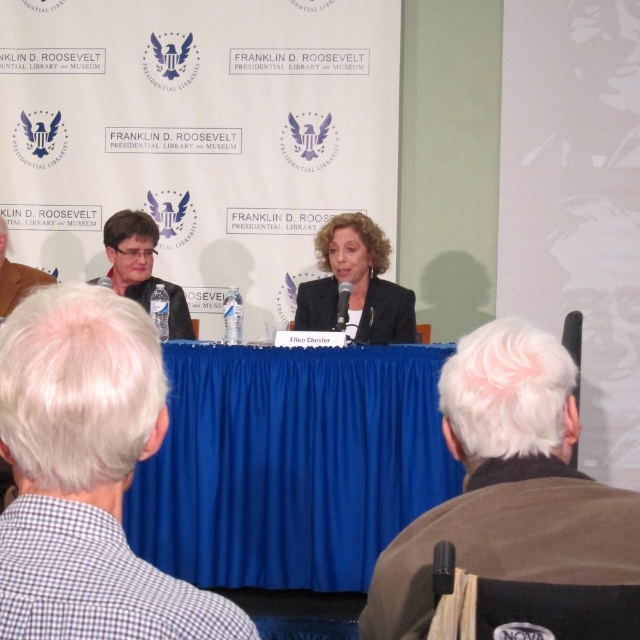
Looking at this image, you are attending the event and want to know the position of the two speakers. Which speaker is wearing the checkered fabric shirt at lower left relative to the brown wool jacket at lower right?

The checkered fabric shirt at lower left is to the left of the brown wool jacket at lower right.

You are attending the event at the Franklin D. Roosevelt Presidential Library and Museum and notice two people sitting at the table. One is wearing a matte black suit at center and the other a matte black jacket at left. Which one is sitting closer to the front of the table?

The matte black suit at center is closer to the viewer than the matte black jacket at left, so the person in the matte black suit at center is sitting closer to the front of the table.

You are attending the event at the Franklin D. Roosevelt Presidential Library and Museum and are standing in the audience. You notice two points marked in the scene. The first point is at coordinates point (x=314, y=573), and the second is at point (x=109, y=512). Which point is closer to you?

Point (x=314, y=573) is further to the camera than point (x=109, y=512), so the point closer to you is point (x=109, y=512).